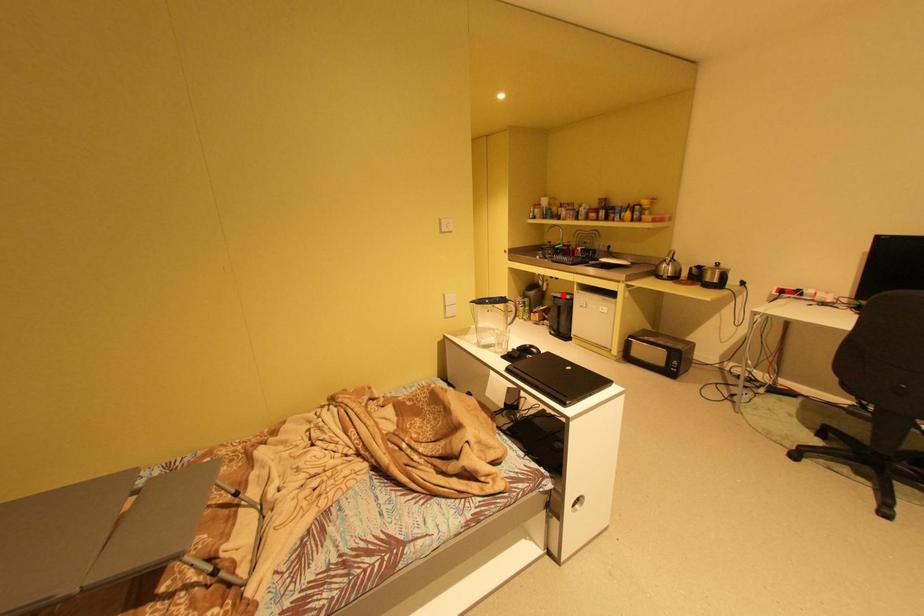
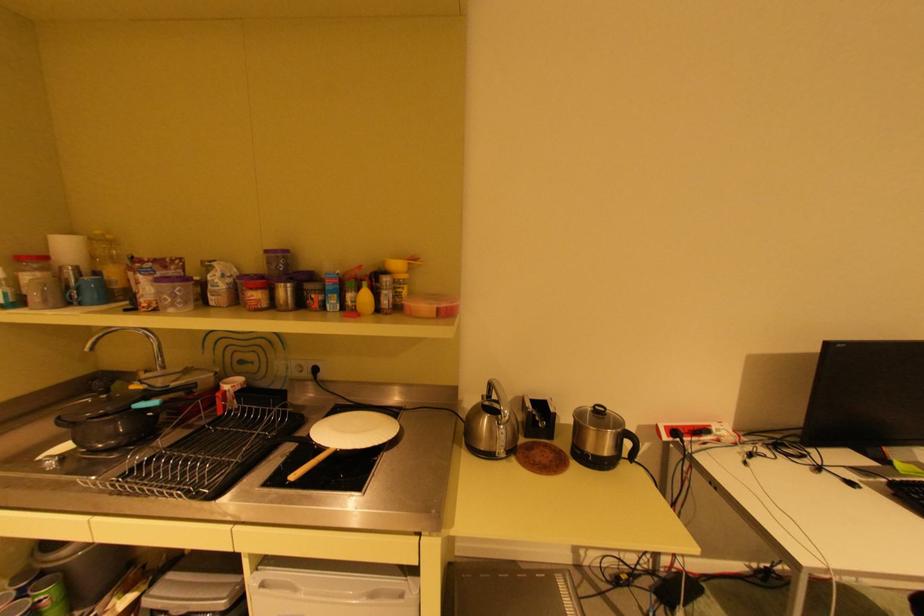
Question: I am providing you with two images of the same scene from different viewpoints. Image1 has a red point marked. In image2, the corresponding 3D location appears at what relative position? Reply with the corresponding letter.

Choices:
 (A) Closer
 (B) Farther

Answer: (A)